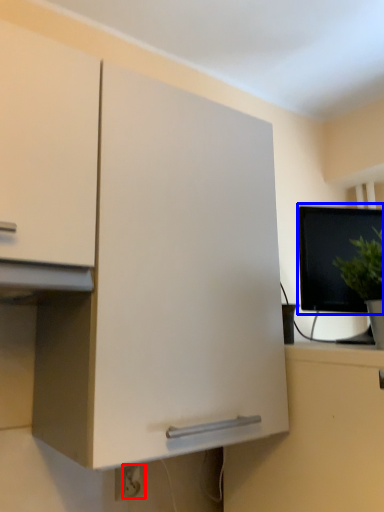
Question: Among these objects, which one is farthest to the camera, electric outlet (highlighted by a red box) or computer monitor (highlighted by a blue box)?

Choices:
 (A) electric outlet
 (B) computer monitor

Answer: (B)